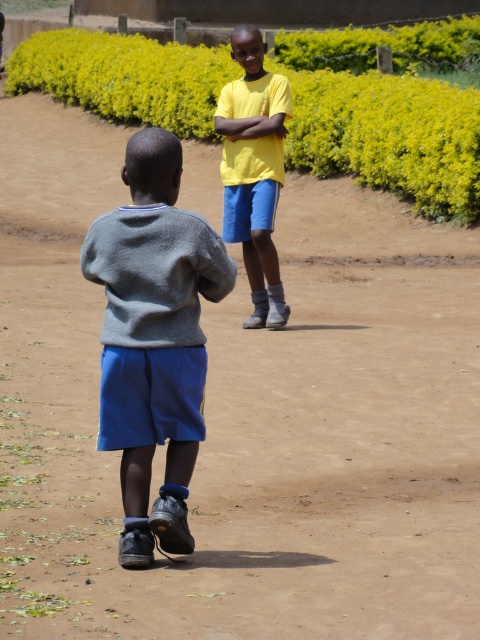
You are a photographer trying to capture both the gray cotton sweater at center and the yellow matte shirt at center in a single frame. Based on their widths, which one would you need to position closer to the camera to ensure both fit properly?

The gray cotton sweater at center is wider than the yellow matte shirt at center. To ensure both fit in the frame, position the wider gray cotton sweater at center closer to the camera so it doesn

In the scene shown: You are a photographer trying to capture the two boys in the scene. You want to focus on the gray cotton sweater at center. Where exactly should you aim your camera to ensure the sweater is in the frame?

The gray cotton sweater at center is located at point coordinates of (154, 339). Aim your camera at those coordinates to capture it in the frame.